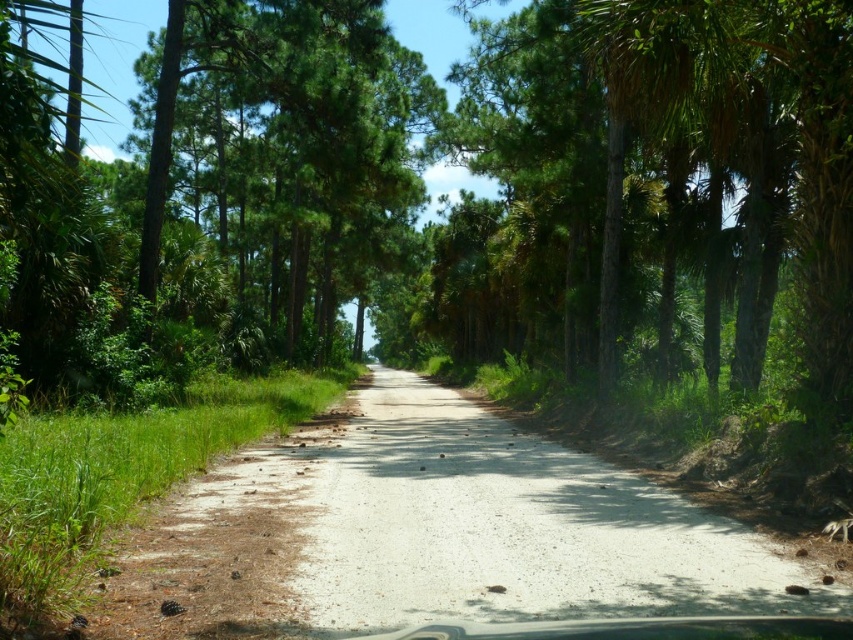
Who is more forward, (57, 346) or (264, 534)?

Point (264, 534) is more forward.

Measure the distance between point (x=728, y=256) and camera.

Point (x=728, y=256) is 61.75 feet from camera.

Identify the location of green leafy tree at center. This screenshot has height=640, width=853. point(459,163).